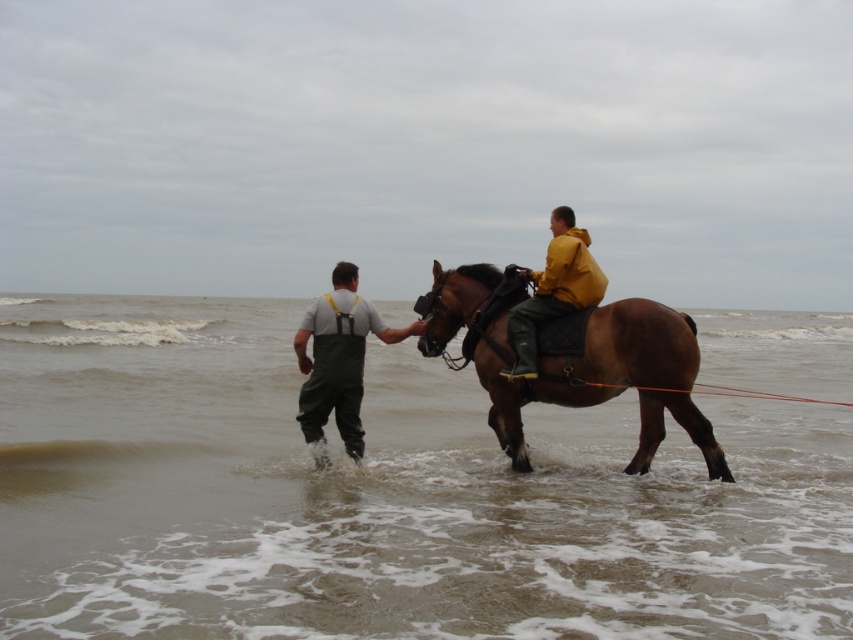
You are a photographer standing at the beach scene described. You want to take a photo that includes both the brown wet sand at lower center and the yellow matte jacket at center. Based on their positions, will the sand appear larger in the photo compared to the jacket?

The brown wet sand at lower center is taller than the yellow matte jacket at center, so in the photo, the sand will appear larger than the jacket.